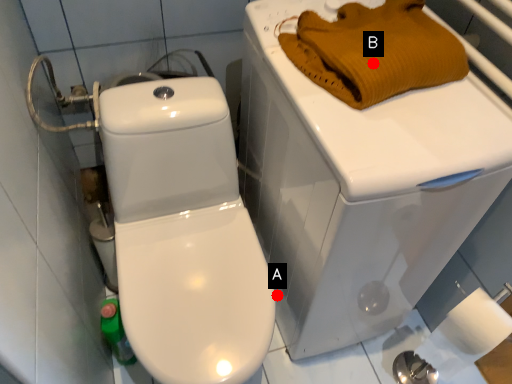
Question: Two points are circled on the image, labeled by A and B beside each circle. Among these points, which one is nearest to the camera?

Choices:
 (A) A is closer
 (B) B is closer

Answer: (B)